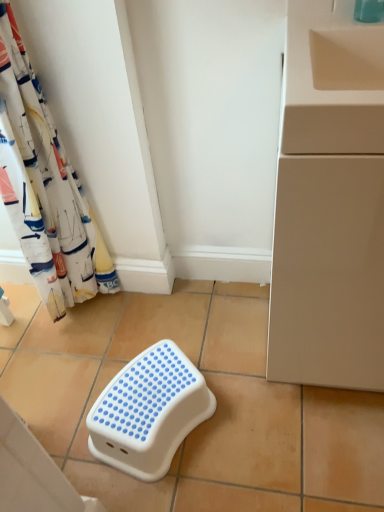
Question: Is white fabric curtain at left to the left or to the right of beige ceramic tile at lower left, placed as the 1th ceramic tile when sorted from left to right, in the image?

Choices:
 (A) left
 (B) right

Answer: (B)

Question: Would you say white fabric curtain at left is inside or outside beige ceramic tile at lower left, placed as the 1th ceramic tile when sorted from left to right?

Choices:
 (A) outside
 (B) inside

Answer: (A)

Question: Estimate the real-world distances between objects in this image. Which object is farther from the beige matte cabinet at right?

Choices:
 (A) white fabric curtain at left
 (B) beige ceramic tile at lower left, placed as the 1th ceramic tile when sorted from left to right
 (C) white plastic step stool at center, which is the 2th ceramic tile from left to right
 (D) white plastic step stool at center

Answer: (B)

Question: Which object is positioned closest to the white plastic step stool at center?

Choices:
 (A) beige ceramic tile at lower left, acting as the 2th ceramic tile starting from the right
 (B) white plastic step stool at center, the first ceramic tile viewed from the right
 (C) beige matte cabinet at right
 (D) white fabric curtain at left

Answer: (B)